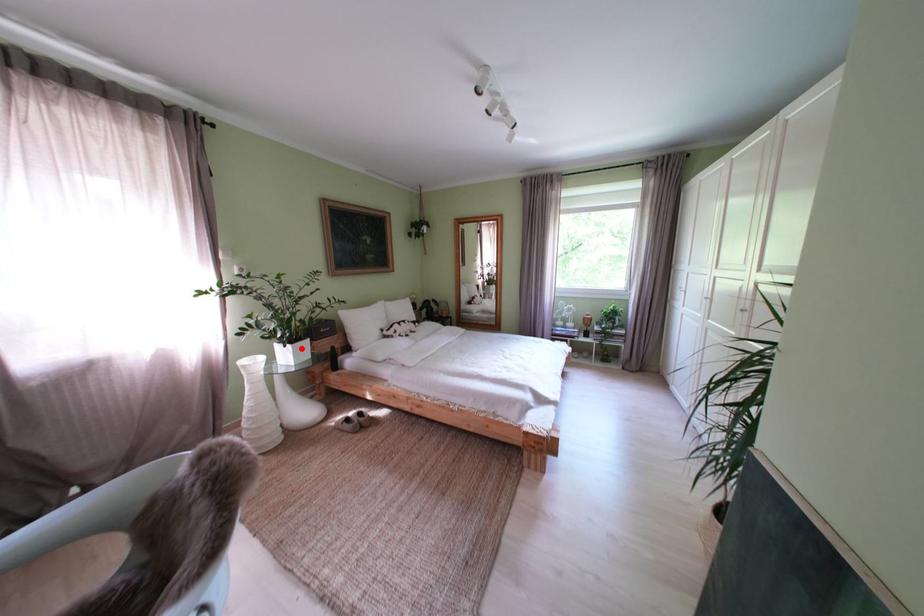
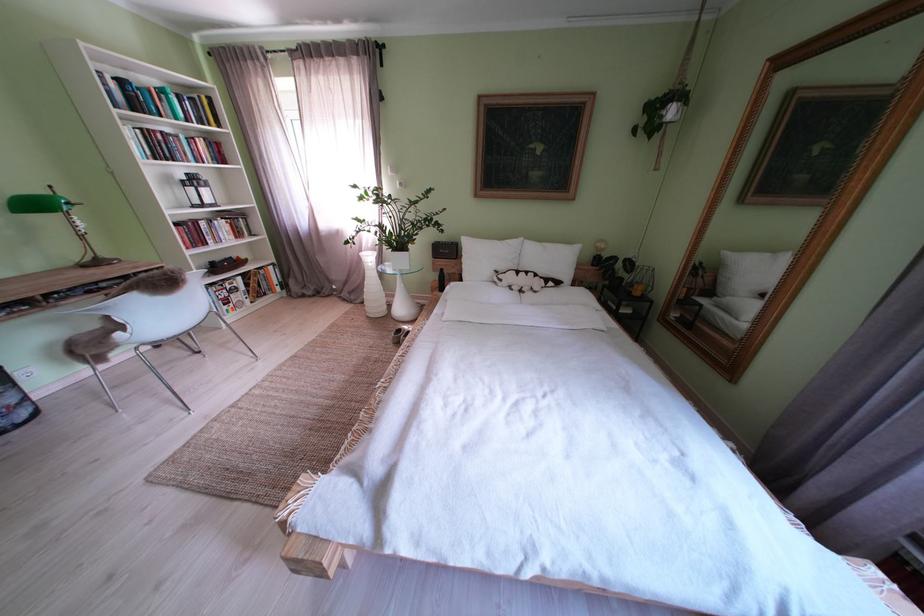
Where in the second image is the point corresponding to the highlighted location from the first image?

(405, 256)